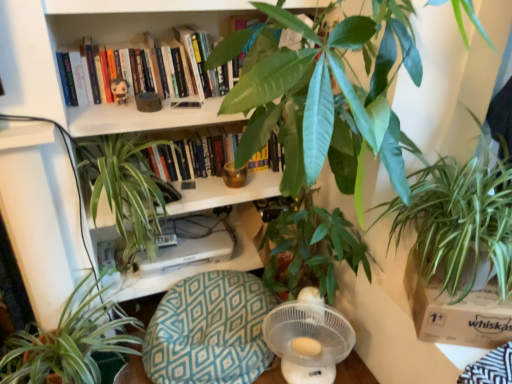
What do you see at coordinates (125, 188) in the screenshot?
I see `green leafy plant at center, the second houseplant from the left` at bounding box center [125, 188].

Find the location of a particular element. The width and height of the screenshot is (512, 384). white plastic fan at lower center is located at coordinates (308, 338).

What is the approximate width of teal diamond-patterned cushion at center?

19.25 inches.

This screenshot has height=384, width=512. Find the location of `plush toy at upper center`. plush toy at upper center is located at coordinates (120, 90).

Identify the location of hardcover book at upper center. The height and width of the screenshot is (384, 512). (170, 67).

From the image's perspective, is green leafy plant at right, the 1th houseplant when ordered from right to left, positioned above or below teal diamond-patterned cushion at center?

green leafy plant at right, the 1th houseplant when ordered from right to left, is above teal diamond-patterned cushion at center.

In the scene shown: Is green leafy plant at right, the 1th houseplant when ordered from right to left, inside the boundaries of teal diamond-patterned cushion at center, or outside?

green leafy plant at right, the 1th houseplant when ordered from right to left, exists outside the volume of teal diamond-patterned cushion at center.

Is green leafy plant at right, which is the fourth houseplant in left-to-right order, with teal diamond-patterned cushion at center?

No.

In terms of size, does green leafy plant at right, which is the fourth houseplant in left-to-right order, appear bigger or smaller than teal diamond-patterned cushion at center?

Clearly, green leafy plant at right, which is the fourth houseplant in left-to-right order, is larger in size than teal diamond-patterned cushion at center.

Is hardcover book at upper center positioned with its back to teal diamond-patterned cushion at center?

No.

Is hardcover book at upper center touching teal diamond-patterned cushion at center?

No, hardcover book at upper center is not making contact with teal diamond-patterned cushion at center.

From the picture: From a real-world perspective, who is located lower, hardcover book at upper center or teal diamond-patterned cushion at center?

In real-world perspective, teal diamond-patterned cushion at center is lower.

Is the position of hardcover book at upper center less distant than that of teal diamond-patterned cushion at center?

No, hardcover book at upper center is behind teal diamond-patterned cushion at center.

From a real-world perspective, between white plastic fan at lower center and hardcover book at upper center, who is vertically lower?

From a 3D spatial view, white plastic fan at lower center is below.

Is white plastic fan at lower center taller than hardcover book at upper center?

Correct, white plastic fan at lower center is much taller as hardcover book at upper center.

What's the angular difference between white plastic fan at lower center and hardcover book at upper center's facing directions?

The facing directions of white plastic fan at lower center and hardcover book at upper center are 24.9 degrees apart.

Based on the photo, is white plastic fan at lower center turned away from hardcover book at upper center?

No.

Is green leafy plant at center, which is counted as the third houseplant, starting from the left, to the left or to the right of green leafy plant at center, the second houseplant from the left, in the image?

green leafy plant at center, which is counted as the third houseplant, starting from the left, is positioned on green leafy plant at center, the second houseplant from the left,'s right side.

Is point (294, 85) farther from viewer compared to point (82, 174)?

No.

Which object is closer to the camera, green leafy plant at center, arranged as the 2th houseplant when viewed from the right, or green leafy plant at center, the 3th houseplant in the right-to-left sequence?

green leafy plant at center, arranged as the 2th houseplant when viewed from the right.

Can you tell me how much green leafy plant at center, arranged as the 2th houseplant when viewed from the right, and green leafy plant at center, the second houseplant from the left, differ in facing direction?

green leafy plant at center, arranged as the 2th houseplant when viewed from the right, and green leafy plant at center, the second houseplant from the left, are facing 90 degrees away from each other.

Is white plastic fan at lower center wider than green leafy plant at center, arranged as the 2th houseplant when viewed from the right?

No.

Considering the sizes of white plastic fan at lower center and green leafy plant at center, arranged as the 2th houseplant when viewed from the right, in the image, is white plastic fan at lower center taller or shorter than green leafy plant at center, arranged as the 2th houseplant when viewed from the right,?

Considering their sizes, white plastic fan at lower center has less height than green leafy plant at center, arranged as the 2th houseplant when viewed from the right.

Which point is more forward, (286, 337) or (269, 116)?

Point (269, 116)

Are white plastic fan at lower center and green leafy plant at center, which is counted as the third houseplant, starting from the left, beside each other?

No, white plastic fan at lower center is not in contact with green leafy plant at center, which is counted as the third houseplant, starting from the left.

At what (x,y) coordinates should I click in order to perform the action: click on houseplant below the green leafy plant at center, arranged as the 2th houseplant when viewed from the right (from the image's perspective). Please return your answer as a coordinate pair (x, y). The image size is (512, 384). Looking at the image, I should click on (70, 344).

What's the angular difference between green leafy plant at lower left, acting as the fourth houseplant starting from the right, and green leafy plant at center, arranged as the 2th houseplant when viewed from the right,'s facing directions?

The facing directions of green leafy plant at lower left, acting as the fourth houseplant starting from the right, and green leafy plant at center, arranged as the 2th houseplant when viewed from the right, are 89.3 degrees apart.

Which is behind, green leafy plant at lower left, acting as the fourth houseplant starting from the right, or green leafy plant at center, which is counted as the third houseplant, starting from the left?

green leafy plant at lower left, acting as the fourth houseplant starting from the right, is behind.

Can you confirm if green leafy plant at lower left, arranged as the first houseplant when viewed from the left, is smaller than green leafy plant at center, which is counted as the third houseplant, starting from the left?

Correct, green leafy plant at lower left, arranged as the first houseplant when viewed from the left, occupies less space than green leafy plant at center, which is counted as the third houseplant, starting from the left.

Can you tell me how much green leafy plant at right, which is the fourth houseplant in left-to-right order, and green leafy plant at lower left, arranged as the first houseplant when viewed from the left, differ in facing direction?

green leafy plant at right, which is the fourth houseplant in left-to-right order, and green leafy plant at lower left, arranged as the first houseplant when viewed from the left, are facing 83.2 degrees away from each other.

Is green leafy plant at right, which is the fourth houseplant in left-to-right order, taller or shorter than green leafy plant at lower left, acting as the fourth houseplant starting from the right?

Clearly, green leafy plant at right, which is the fourth houseplant in left-to-right order, is taller compared to green leafy plant at lower left, acting as the fourth houseplant starting from the right.

Choose the correct answer: Is green leafy plant at right, which is the fourth houseplant in left-to-right order, inside green leafy plant at lower left, arranged as the first houseplant when viewed from the left, or outside it?

green leafy plant at right, which is the fourth houseplant in left-to-right order, cannot be found inside green leafy plant at lower left, arranged as the first houseplant when viewed from the left.

Which is behind, point (410, 199) or point (17, 342)?

The point (17, 342) is more distant.

From a real-world perspective, which houseplant is the 4th one above the teal diamond-patterned cushion at center? Please provide its 2D coordinates.

[(458, 217)]

Find the location of `book that is on the left side of teal diamond-patterned cushion at center`. book that is on the left side of teal diamond-patterned cushion at center is located at coordinates (170, 67).

Considering their positions, is green leafy plant at center, the 3th houseplant in the right-to-left sequence, positioned further to green leafy plant at lower left, arranged as the first houseplant when viewed from the left, than white cardboard box at lower right?

Among the two, white cardboard box at lower right is located further to green leafy plant at lower left, arranged as the first houseplant when viewed from the left.

When comparing their distances from plush toy at upper center, does green leafy plant at center, the second houseplant from the left, or teal diamond-patterned cushion at center seem further?

Based on the image, teal diamond-patterned cushion at center appears to be further to plush toy at upper center.

From the image, which object appears to be farther from teal diamond-patterned cushion at center, green leafy plant at right, which is the fourth houseplant in left-to-right order, or green leafy plant at center, the 3th houseplant in the right-to-left sequence?

The object further to teal diamond-patterned cushion at center is green leafy plant at right, which is the fourth houseplant in left-to-right order.

Looking at the image, which one is located closer to green leafy plant at center, the 3th houseplant in the right-to-left sequence, hardcover book at upper center or plush toy at upper center?

hardcover book at upper center lies closer to green leafy plant at center, the 3th houseplant in the right-to-left sequence, than the other object.

Which object lies nearer to the anchor point green leafy plant at lower left, acting as the fourth houseplant starting from the right, white cardboard box at lower right or green leafy plant at center, which is counted as the third houseplant, starting from the left?

green leafy plant at center, which is counted as the third houseplant, starting from the left, lies closer to green leafy plant at lower left, acting as the fourth houseplant starting from the right, than the other object.

Based on their spatial positions, is hardcover book at upper center or teal diamond-patterned cushion at center further from green leafy plant at center, which is counted as the third houseplant, starting from the left?

Among the two, teal diamond-patterned cushion at center is located further to green leafy plant at center, which is counted as the third houseplant, starting from the left.

Estimate the real-world distances between objects in this image. Which object is closer to white plastic fan at lower center, green leafy plant at lower left, arranged as the first houseplant when viewed from the left, or plush toy at upper center?

green leafy plant at lower left, arranged as the first houseplant when viewed from the left, lies closer to white plastic fan at lower center than the other object.

Considering their positions, is white plastic fan at lower center positioned further to hardcover book at upper center than teal diamond-patterned cushion at center?

white plastic fan at lower center.

Locate an element on the screen. mechanical fan between teal diamond-patterned cushion at center and white cardboard box at lower right from left to right is located at coordinates (308, 338).

Identify the location of mechanical fan between green leafy plant at lower left, arranged as the first houseplant when viewed from the left, and white cardboard box at lower right from left to right. (308, 338).

Where is `mechanical fan between green leafy plant at center, the second houseplant from the left, and green leafy plant at right, the 1th houseplant when ordered from right to left, from left to right`? The image size is (512, 384). mechanical fan between green leafy plant at center, the second houseplant from the left, and green leafy plant at right, the 1th houseplant when ordered from right to left, from left to right is located at coordinates (308, 338).

Where is `mechanical fan between plush toy at upper center and white cardboard box at lower right`? Image resolution: width=512 pixels, height=384 pixels. mechanical fan between plush toy at upper center and white cardboard box at lower right is located at coordinates (308, 338).